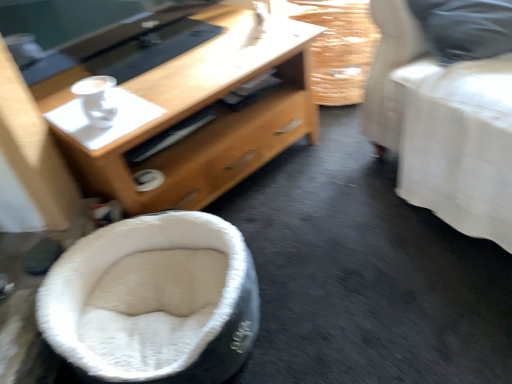
Question: Would you say burlap-like fabric basket at upper right is outside wooden desk at center?

Choices:
 (A) yes
 (B) no

Answer: (A)

Question: Can you confirm if burlap-like fabric basket at upper right is positioned to the left of wooden desk at center?

Choices:
 (A) no
 (B) yes

Answer: (A)

Question: Is burlap-like fabric basket at upper right surrounding wooden desk at center?

Choices:
 (A) yes
 (B) no

Answer: (B)

Question: Is burlap-like fabric basket at upper right closer to camera compared to wooden desk at center?

Choices:
 (A) yes
 (B) no

Answer: (B)

Question: Is burlap-like fabric basket at upper right aimed at wooden desk at center?

Choices:
 (A) no
 (B) yes

Answer: (A)

Question: Is burlap-like fabric basket at upper right further to camera compared to wooden desk at center?

Choices:
 (A) no
 (B) yes

Answer: (B)

Question: From the image's perspective, would you say white fuzzy bean bag at lower left is positioned over white glossy cup at upper left?

Choices:
 (A) yes
 (B) no

Answer: (B)

Question: Would you say white fuzzy bean bag at lower left is a long distance from white glossy cup at upper left?

Choices:
 (A) yes
 (B) no

Answer: (B)

Question: Considering the relative sizes of white fuzzy bean bag at lower left and white glossy cup at upper left in the image provided, is white fuzzy bean bag at lower left wider than white glossy cup at upper left?

Choices:
 (A) yes
 (B) no

Answer: (A)

Question: Is white fuzzy bean bag at lower left at the right side of white glossy cup at upper left?

Choices:
 (A) no
 (B) yes

Answer: (B)

Question: Could you tell me if white fuzzy bean bag at lower left is facing white glossy cup at upper left?

Choices:
 (A) yes
 (B) no

Answer: (B)

Question: Considering the relative positions of white fuzzy bean bag at lower left and white glossy cup at upper left in the image provided, is white fuzzy bean bag at lower left to the left of white glossy cup at upper left from the viewer's perspective?

Choices:
 (A) yes
 (B) no

Answer: (B)

Question: Is white glossy cup at upper left smaller than burlap-like fabric basket at upper right?

Choices:
 (A) no
 (B) yes

Answer: (B)